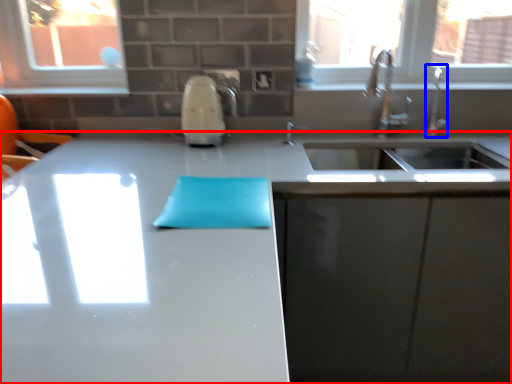
Question: Which of the following is the closest to the observer, countertop (highlighted by a red box) or faucet (highlighted by a blue box)?

Choices:
 (A) countertop
 (B) faucet

Answer: (A)